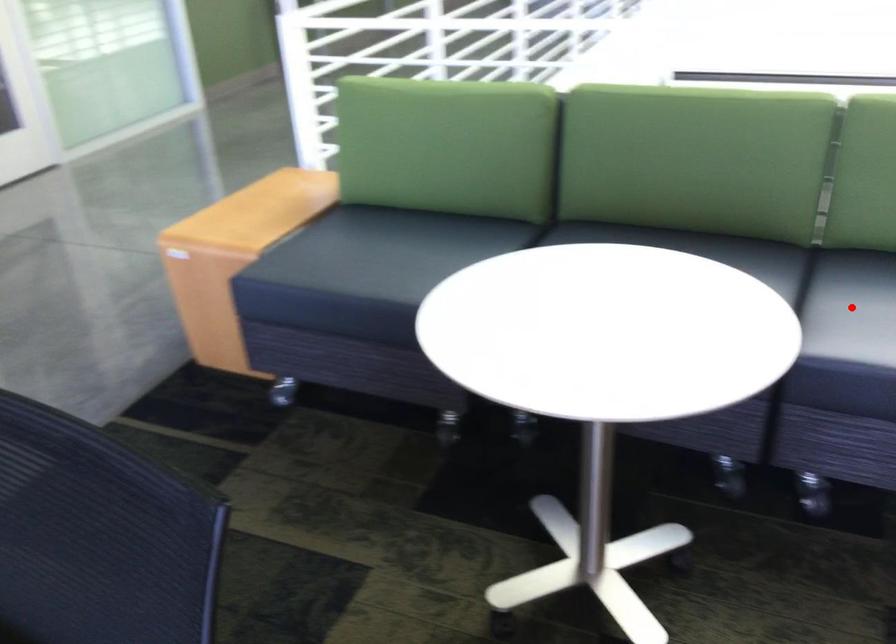
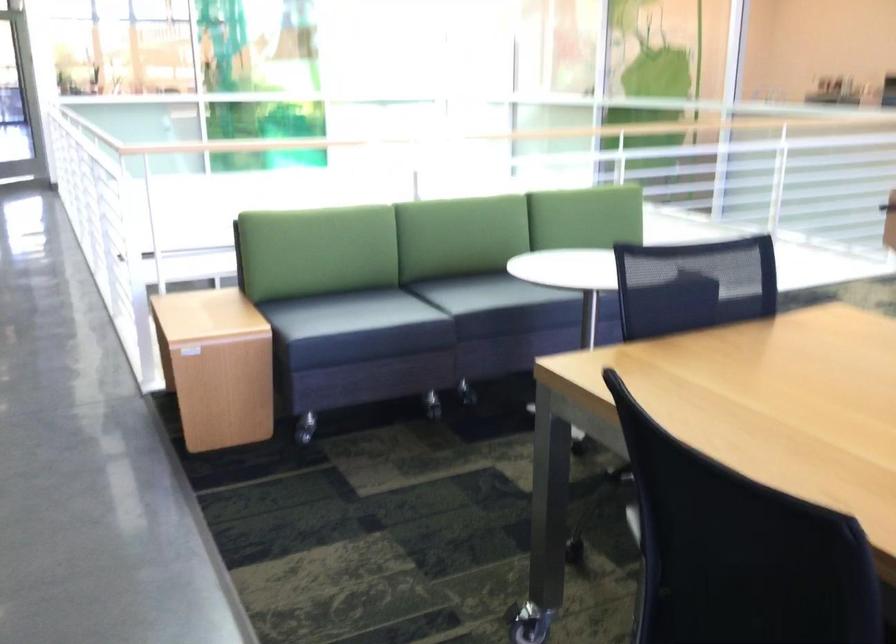
Question: I am providing you with two images of the same scene from different viewpoints. A red point is marked on the first image. At the location where the point appears in image 1, is it still visible in image 2?

Choices:
 (A) Yes
 (B) No

Answer: (B)